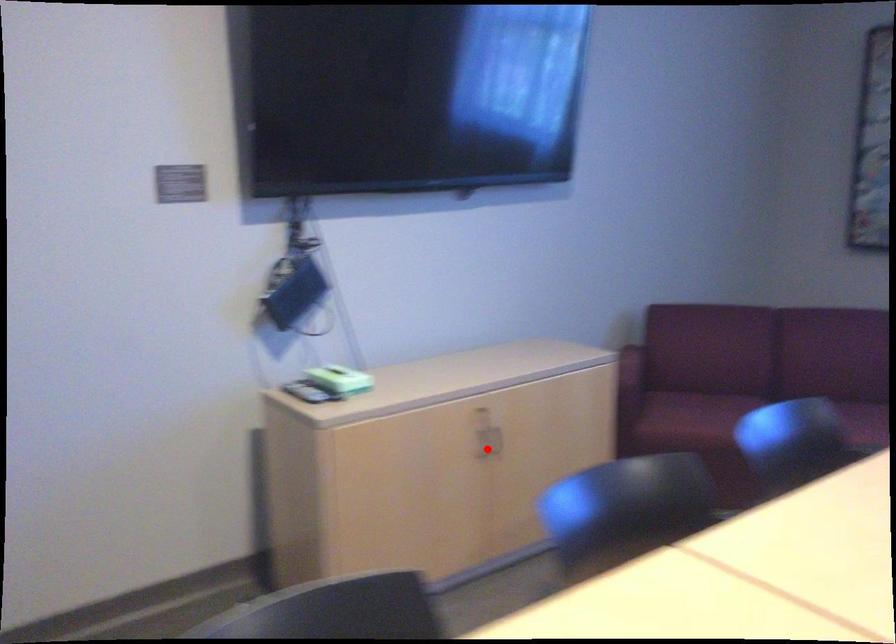
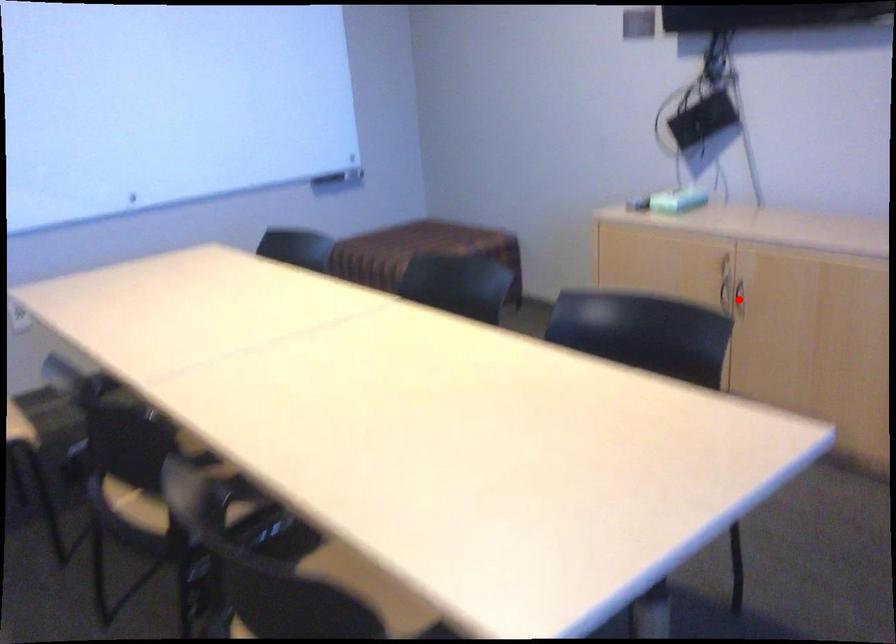
I am providing you with two images of the same scene from different viewpoints. A red point is marked on the first image and another point is marked on the second image. Is the marked point in image1 the same physical position as the marked point in image2?

Yes